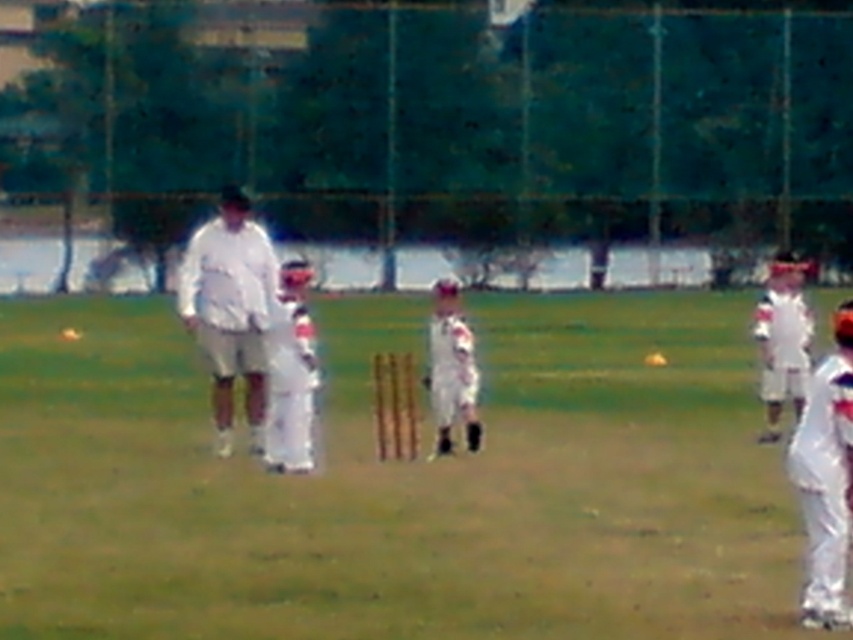
You are a cricket player preparing to hit the ball. You see two cricket bats at the center of the field, a white fabric cricket bat at center and a white matte cricket bat at center. Which bat should you choose if you want to grab the one closer to you?

You should grab the white fabric cricket bat at center because it is in front of the white matte cricket bat at center, making it closer to you.

You are a spectator standing behind the netted fence watching the cricket match. You notice the white fabric cricket bat at center and the white matte baseball uniform at center. Which object appears larger in your view?

The white fabric cricket bat at center appears larger because it is closer to the viewer than the white matte baseball uniform at center.